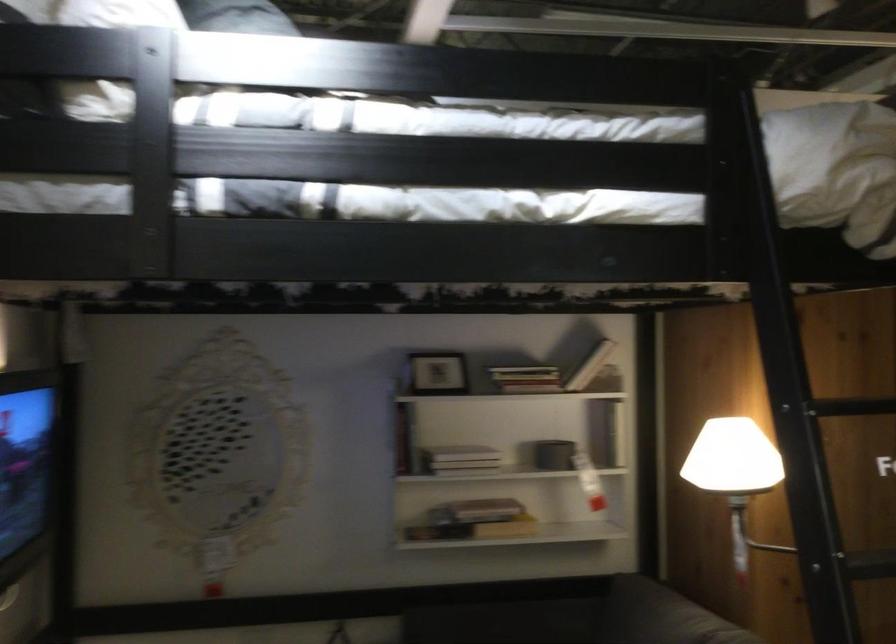
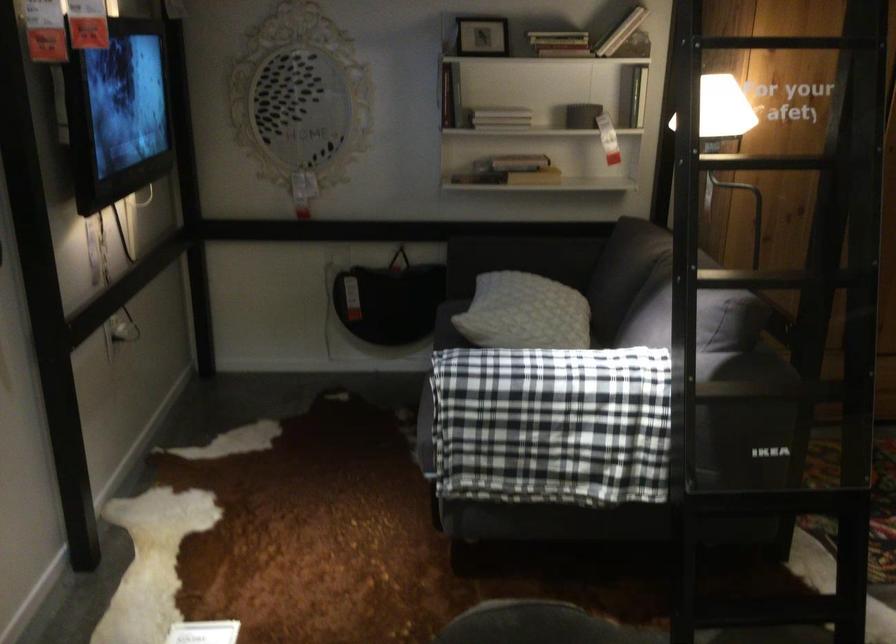
Where in the second image is the point corresponding to pixel 467 473 from the first image?

(500, 118)